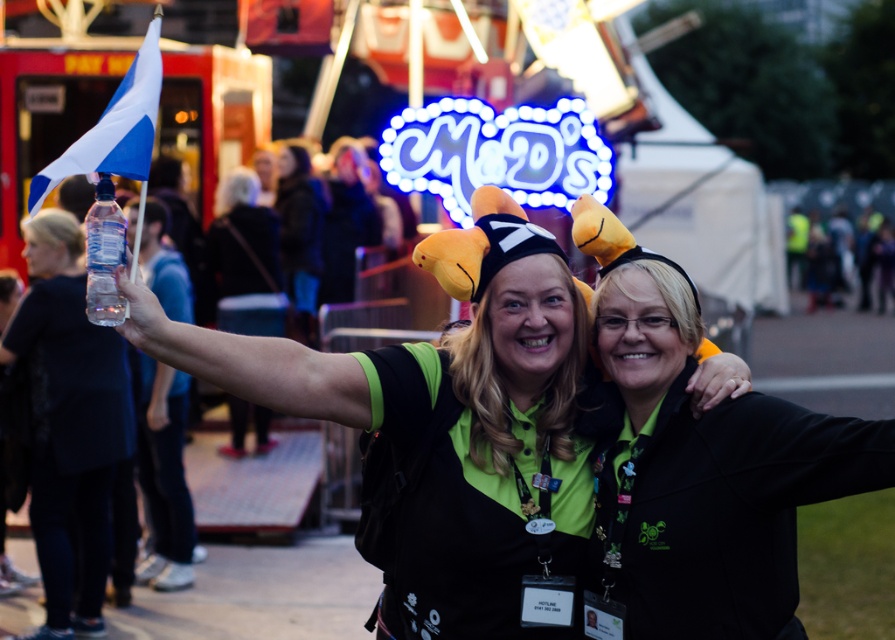
Question: Where is black matte hat at center located in relation to clear plastic bottle at upper left in the image?

Choices:
 (A) right
 (B) left

Answer: (A)

Question: Can you confirm if black matte hat at center is thinner than clear plastic bottle at upper left?

Choices:
 (A) yes
 (B) no

Answer: (B)

Question: Observing the image, what is the correct spatial positioning of black matte hat at center in reference to clear plastic bottle at upper left?

Choices:
 (A) left
 (B) right

Answer: (B)

Question: Which object appears closest to the camera in this image?

Choices:
 (A) clear plastic bottle at upper left
 (B) black matte hat at center

Answer: (B)